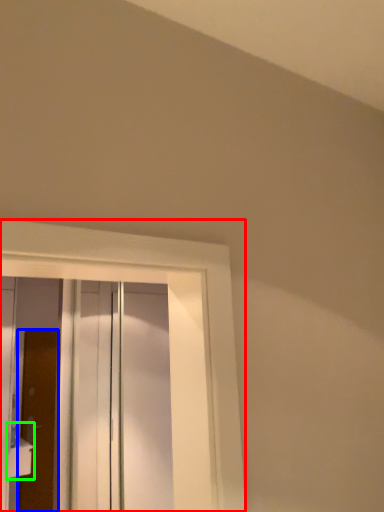
Question: Estimate the real-world distances between objects in this image. Which object is farther from window (highlighted by a red box), door (highlighted by a blue box) or sink (highlighted by a green box)?

Choices:
 (A) door
 (B) sink

Answer: (A)